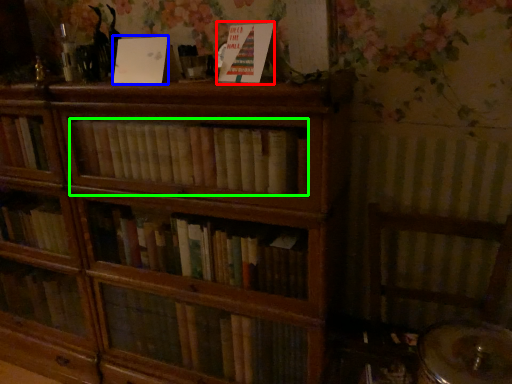
Question: Considering the real-world distances, which object is closest to paperback book (highlighted by a red box)? paperback book (highlighted by a blue box) or book (highlighted by a green box).

Choices:
 (A) paperback book
 (B) book

Answer: (A)